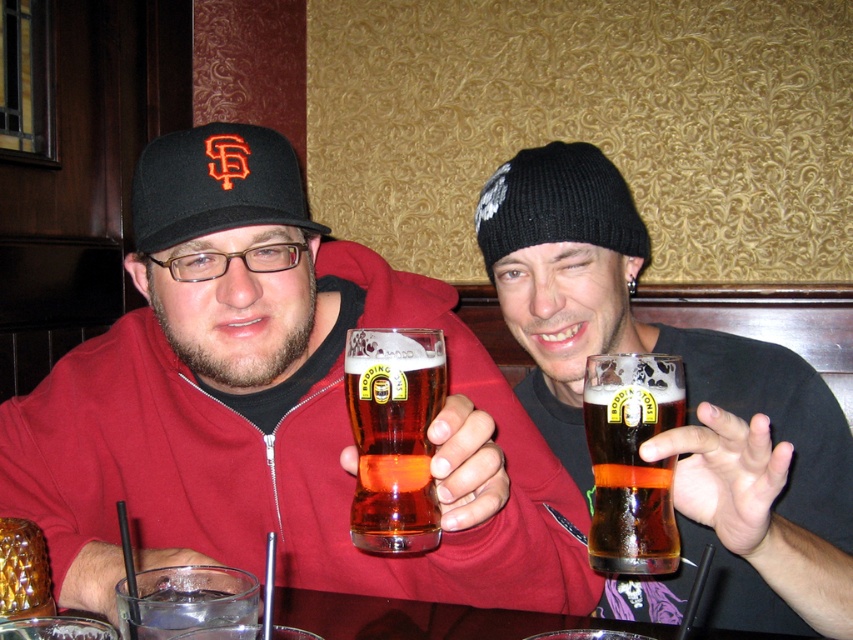
You are a waiter in a bar. You see a customer wearing a black fabric baseball cap at left and holding a clear glass at lower left. The customer asks you to refill their drink. Which item should you focus on to ensure you pour the drink correctly?

The black fabric baseball cap at left is above clear glass at lower left, so you should focus on the clear glass at lower left to pour the drink correctly since it is the drinking vessel below the cap.

You are a bartender who needs to place a coaster between the amber glass beer at center and the clear glass at lower left. The coaster has a diameter of 4 inches. Is there enough space between them to fit the coaster without moving the glasses?

The distance between the amber glass beer at center and the clear glass at lower left is 5.71 inches. Since the coaster has a diameter of 4 inches, there is enough space to place it between them without moving the glasses.